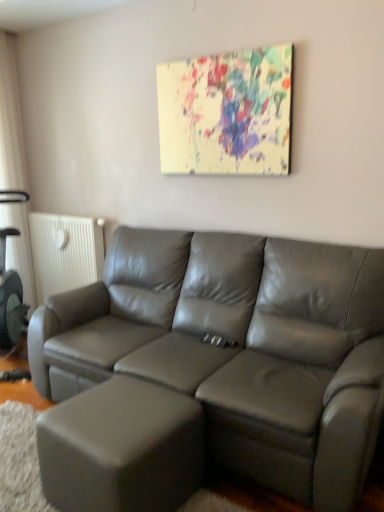
Question: Should I look upward or downward to see satin gray leather couch at center?

Choices:
 (A) down
 (B) up

Answer: (A)

Question: Is satin gray leather couch at center oriented away from white textured radiator at left?

Choices:
 (A) yes
 (B) no

Answer: (B)

Question: From a real-world perspective, is satin gray leather couch at center physically below white textured radiator at left?

Choices:
 (A) no
 (B) yes

Answer: (B)

Question: Does satin gray leather couch at center turn towards white textured radiator at left?

Choices:
 (A) no
 (B) yes

Answer: (A)

Question: From the image's perspective, does satin gray leather couch at center appear higher than white textured radiator at left?

Choices:
 (A) yes
 (B) no

Answer: (B)

Question: Does satin gray leather couch at center have a lesser width compared to white textured radiator at left?

Choices:
 (A) yes
 (B) no

Answer: (B)

Question: Considering the relative positions of satin gray leather couch at center and white textured radiator at left in the image provided, is satin gray leather couch at center to the right of white textured radiator at left from the viewer's perspective?

Choices:
 (A) yes
 (B) no

Answer: (A)

Question: Is satin gray leather couch at center facing towards painted canvas at upper center?

Choices:
 (A) no
 (B) yes

Answer: (A)

Question: Does satin gray leather couch at center have a lesser width compared to painted canvas at upper center?

Choices:
 (A) yes
 (B) no

Answer: (B)

Question: Is satin gray leather couch at center turned away from painted canvas at upper center?

Choices:
 (A) no
 (B) yes

Answer: (A)

Question: From the image's perspective, is satin gray leather couch at center on top of painted canvas at upper center?

Choices:
 (A) yes
 (B) no

Answer: (B)

Question: Would you consider satin gray leather couch at center to be distant from painted canvas at upper center?

Choices:
 (A) yes
 (B) no

Answer: (B)

Question: From the image's perspective, does satin gray leather couch at center appear lower than painted canvas at upper center?

Choices:
 (A) yes
 (B) no

Answer: (A)

Question: Is white textured radiator at left outside painted canvas at upper center?

Choices:
 (A) yes
 (B) no

Answer: (A)